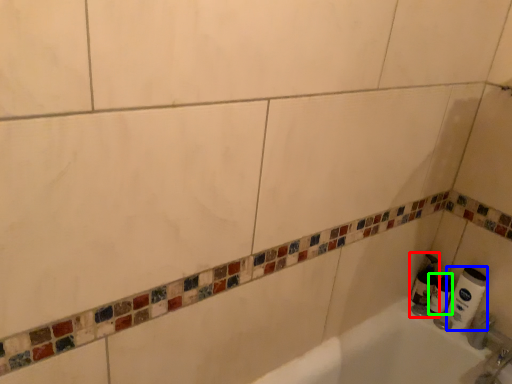
Question: Which object is the closest to the soap dispenser (highlighted by a red box)? Choose among these: toilet paper (highlighted by a blue box) or toilet paper (highlighted by a green box).

Choices:
 (A) toilet paper
 (B) toilet paper

Answer: (B)